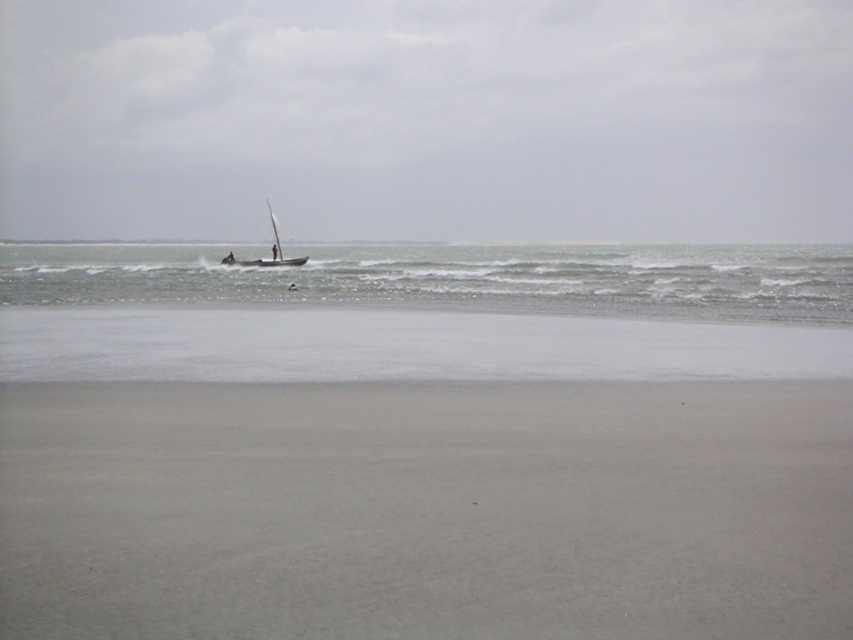
Question: Which point is farther to the camera?

Choices:
 (A) wooden sailboat at center
 (B) smooth sand at lower center

Answer: (A)

Question: Which point is farther to the camera?

Choices:
 (A) white matte sailboat at center
 (B) smooth sand at lower center
 (C) clear water at center
 (D) wooden sailboat at center

Answer: (A)

Question: Is smooth sand at lower center smaller than clear water at center?

Choices:
 (A) yes
 (B) no

Answer: (A)

Question: Is clear water at center smaller than wooden sailboat at center?

Choices:
 (A) yes
 (B) no

Answer: (B)

Question: Does white matte sailboat at center have a greater width compared to wooden sailboat at center?

Choices:
 (A) no
 (B) yes

Answer: (B)

Question: Which object is the farthest from the smooth sand at lower center?

Choices:
 (A) clear water at center
 (B) wooden sailboat at center
 (C) white matte sailboat at center

Answer: (C)